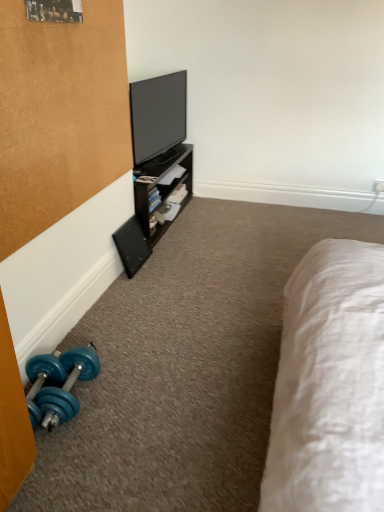
This screenshot has width=384, height=512. Identify the location of free space in front of blue rubber dumbbell at lower left. (76, 458).